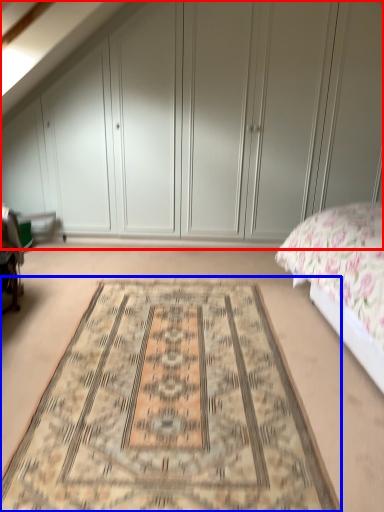
Question: Which object is closer to the camera taking this photo, dresser (highlighted by a red box) or mat (highlighted by a blue box)?

Choices:
 (A) dresser
 (B) mat

Answer: (B)